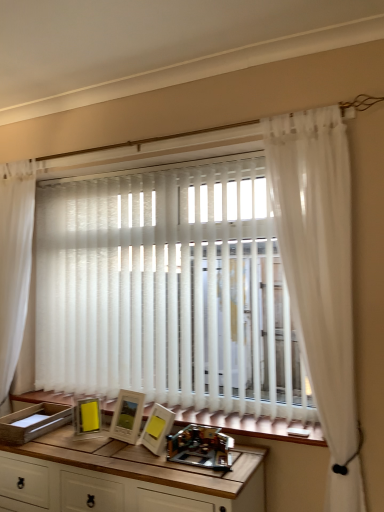
Question: Is white sheer curtain at right, the second curtain positioned from the left, placed right next to wooden table at center?

Choices:
 (A) yes
 (B) no

Answer: (B)

Question: From a real-world perspective, is white sheer curtain at right, the second curtain positioned from the left, beneath wooden table at center?

Choices:
 (A) no
 (B) yes

Answer: (A)

Question: Does white sheer curtain at right, the second curtain positioned from the left, have a greater width compared to wooden table at center?

Choices:
 (A) no
 (B) yes

Answer: (A)

Question: From the image's perspective, is white sheer curtain at right, which is the first curtain from front to back, located beneath wooden table at center?

Choices:
 (A) yes
 (B) no

Answer: (B)

Question: From a real-world perspective, is white sheer curtain at right, the second curtain when ordered from back to front, on wooden table at center?

Choices:
 (A) yes
 (B) no

Answer: (A)

Question: Can you confirm if white sheer curtain at right, the second curtain positioned from the left, is taller than wooden table at center?

Choices:
 (A) yes
 (B) no

Answer: (A)

Question: Is wooden table at center to the right of metallic plastic toy at center from the viewer's perspective?

Choices:
 (A) yes
 (B) no

Answer: (B)

Question: Considering the relative sizes of wooden table at center and metallic plastic toy at center in the image provided, is wooden table at center thinner than metallic plastic toy at center?

Choices:
 (A) yes
 (B) no

Answer: (B)

Question: Is wooden table at center far from metallic plastic toy at center?

Choices:
 (A) yes
 (B) no

Answer: (B)

Question: Does wooden table at center have a lesser height compared to metallic plastic toy at center?

Choices:
 (A) yes
 (B) no

Answer: (B)

Question: Is wooden table at center in contact with metallic plastic toy at center?

Choices:
 (A) no
 (B) yes

Answer: (A)

Question: Is wooden table at center in front of metallic plastic toy at center?

Choices:
 (A) no
 (B) yes

Answer: (B)

Question: Can you confirm if white sheer curtain at left, the 1th curtain in the left-to-right sequence, is positioned to the right of wooden table at center?

Choices:
 (A) no
 (B) yes

Answer: (A)